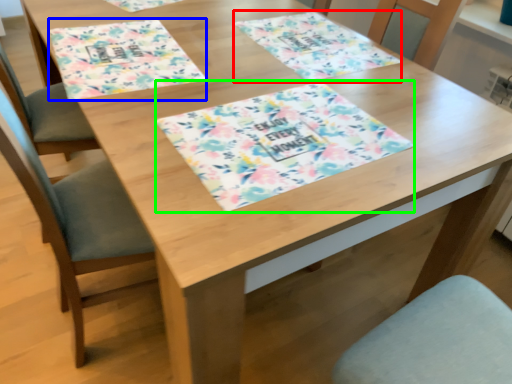
Question: Estimate the real-world distances between objects in this image. Which object is closer to place mat (highlighted by a red box), place mat (highlighted by a blue box) or tablecloth (highlighted by a green box)?

Choices:
 (A) place mat
 (B) tablecloth

Answer: (B)